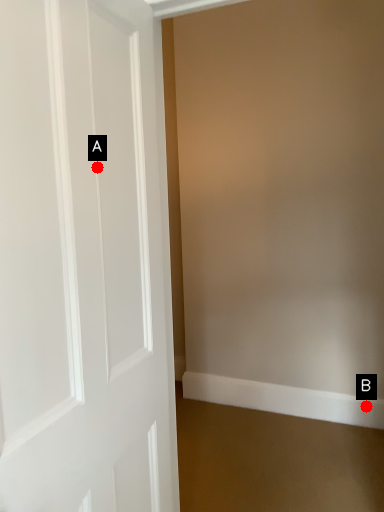
Question: Two points are circled on the image, labeled by A and B beside each circle. Which point is further to the camera?

Choices:
 (A) A is further
 (B) B is further

Answer: (B)